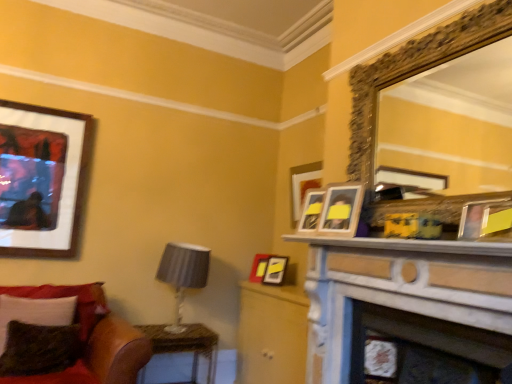
At what (x,y) coordinates should I click in order to perform the action: click on vacant space underneath satin gray lampshade at lower left (from a real-world perspective). Please return your answer as a coordinate pair (x, y). Image resolution: width=512 pixels, height=384 pixels. Looking at the image, I should click on (180, 327).